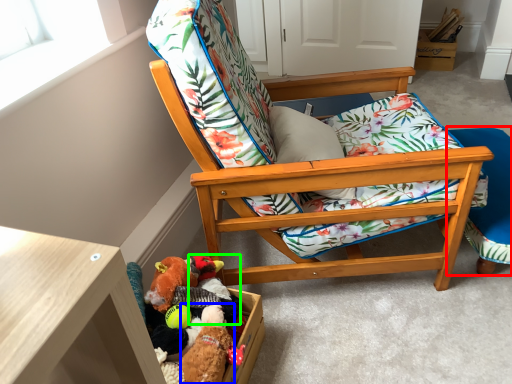
Question: Estimate the real-world distances between objects in this image. Which object is farther from folding chair (highlighted by a red box), toy (highlighted by a blue box) or toy (highlighted by a green box)?

Choices:
 (A) toy
 (B) toy

Answer: (A)